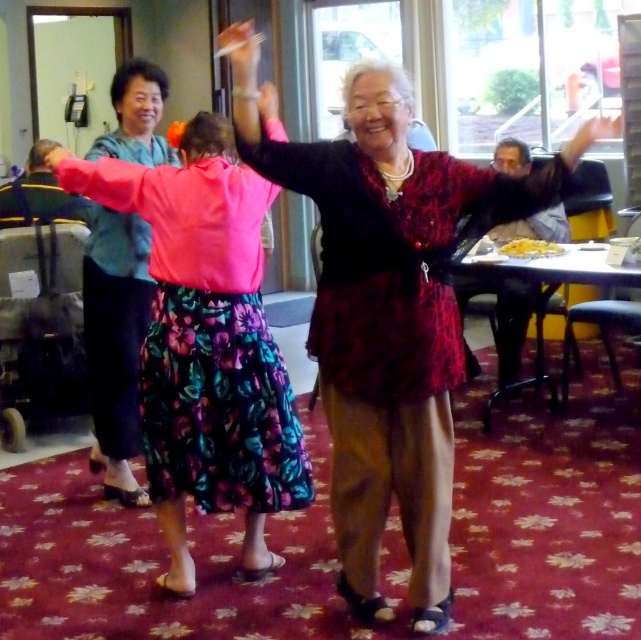
You are an artist trying to sketch the scene. You need to decide which object to draw first based on their sizes. Since the white matte paper at upper center is smaller than the smooth skin hand at upper right, which one should you start with if you want to draw the smaller object first?

The white matte paper at upper center has a lesser width compared to the smooth skin hand at upper right, so you should start by drawing the white matte paper at upper center first since it is smaller.

You are a photographer trying to capture the woman in the pink blouse and floral skirt. You notice two points marked in the scene. Which point, point 1 at coordinates (246, 42) or point 2 at coordinates (595, 129), is closer to the camera and thus better suited for focusing on her?

Point 1 at coordinates (246, 42) is closer to the camera than point 2 at coordinates (595, 129), so it is better suited for focusing on the woman in the pink blouse and floral skirt.